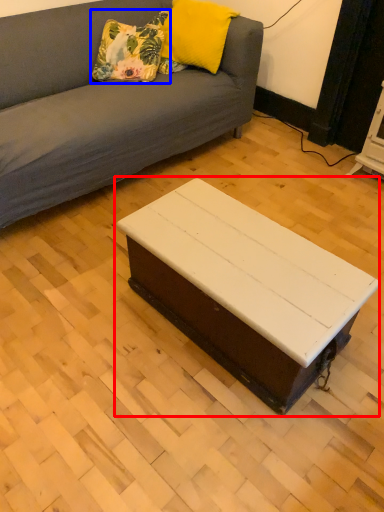
Question: Which object appears farthest to the camera in this image, coffee table (highlighted by a red box) or pillow (highlighted by a blue box)?

Choices:
 (A) coffee table
 (B) pillow

Answer: (B)